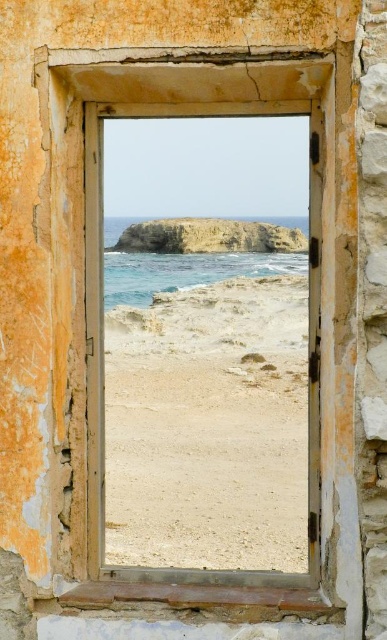
Question: Which point appears farthest from the camera in this image?

Choices:
 (A) 82,90
 (B) 150,346

Answer: (B)

Question: Is beige sandy beach at center wider than rusty metal window frame at center?

Choices:
 (A) yes
 (B) no

Answer: (A)

Question: From the image, what is the correct spatial relationship of beige sandy beach at center in relation to rusty metal window frame at center?

Choices:
 (A) above
 (B) below

Answer: (A)

Question: In this image, where is beige sandy beach at center located relative to rusty metal window frame at center?

Choices:
 (A) left
 (B) right

Answer: (A)

Question: Which of the following is the farthest from the observer?

Choices:
 (A) (99, 160)
 (B) (162, 340)

Answer: (B)